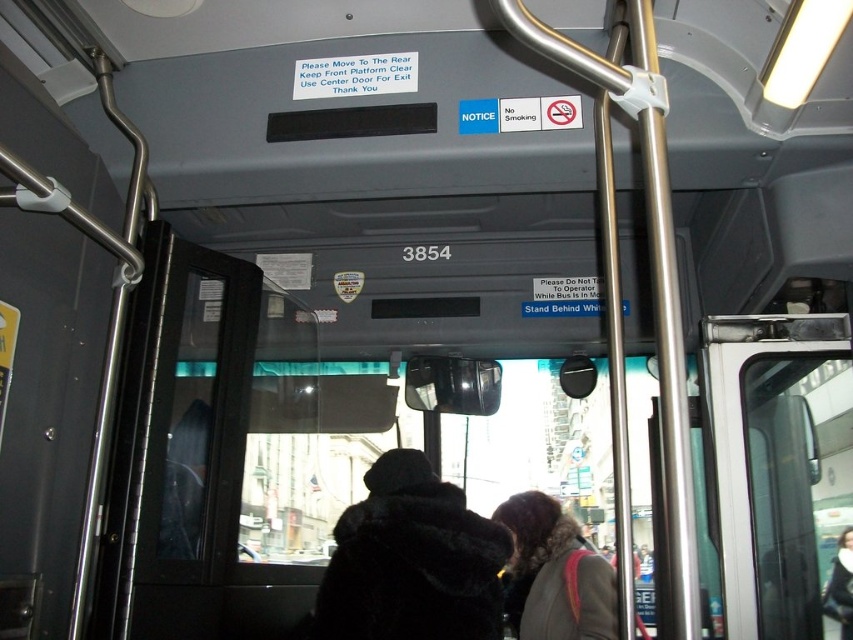
In the scene shown: Does black fur coat at center appear on the left side of dark brown fur coat at center?

Yes, black fur coat at center is to the left of dark brown fur coat at center.

Is point (367, 618) more distant than point (511, 532)?

No, (367, 618) is closer to viewer.

Image resolution: width=853 pixels, height=640 pixels. In order to click on black fur coat at center in this screenshot , I will do pyautogui.click(x=410, y=561).